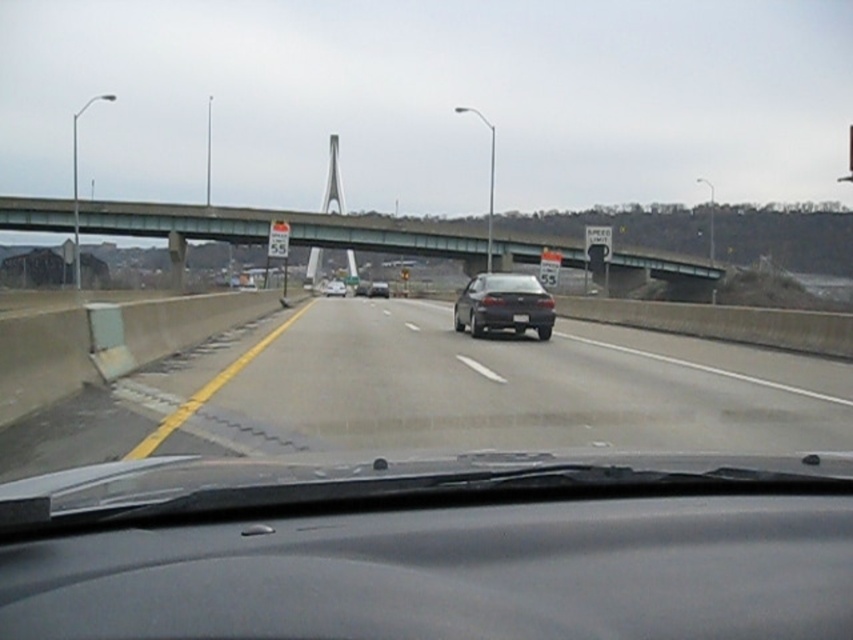
Question: Does green concrete bridge at upper center appear on the right side of satin black sedan at center?

Choices:
 (A) yes
 (B) no

Answer: (B)

Question: Which of the following is the farthest from the observer?

Choices:
 (A) shiny silver sedan at center
 (B) concrete barrier at lower left
 (C) shiny black sedan at center

Answer: (C)

Question: From the image, what is the correct spatial relationship of satin black sedan at center in relation to shiny silver sedan at center?

Choices:
 (A) above
 (B) below

Answer: (B)

Question: Is shiny black sedan at center above shiny silver sedan at center?

Choices:
 (A) yes
 (B) no

Answer: (B)

Question: Among these points, which one is nearest to the camera?

Choices:
 (A) (335, 282)
 (B) (312, 330)

Answer: (B)

Question: Which point is closer to the camera taking this photo?

Choices:
 (A) (334, 296)
 (B) (555, 362)
 (C) (78, 211)
 (D) (374, 285)

Answer: (B)